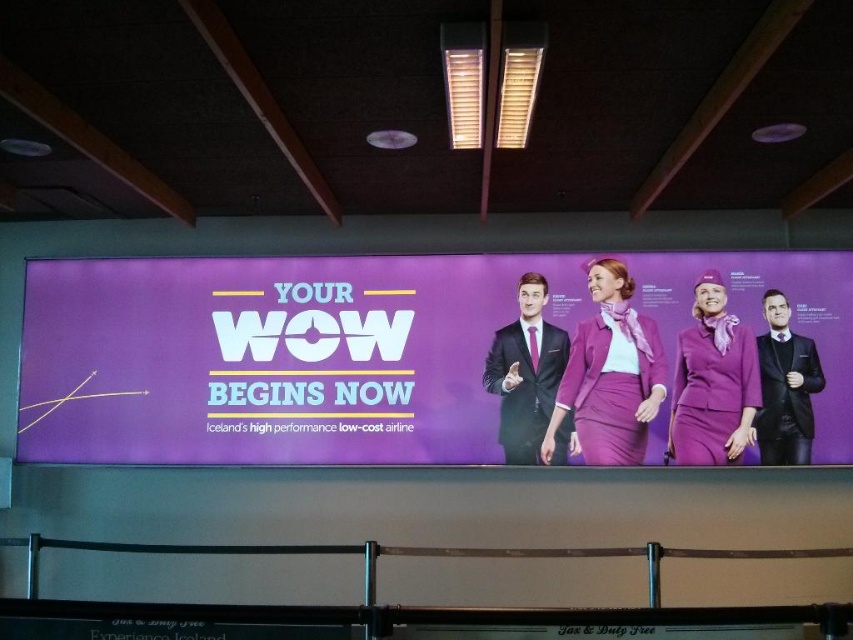
You are an airport employee who needs to place a new sign on the wall. The sign is 1.2 meters wide. There is a purple fabric billboard at center and a matte black suit at center in the scene. Can the sign fit between them without overlapping?

The purple fabric billboard at center is bigger than the matte black suit at center, but the exact distance between them isn not provided. Without knowing the spacing between the two objects, it is impossible to determine if the 1.2 meter wide sign can fit between them.

You are standing at the entrance of the airport and want to locate the purple fabric billboard at center. According to the coordinates, where is it positioned?

The purple fabric billboard at center is positioned at coordinates point (283, 356).